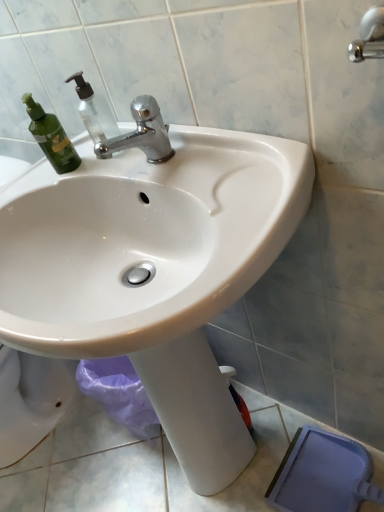
Question: Can you confirm if white glossy sink at center is shorter than polished chrome faucet at upper center?

Choices:
 (A) no
 (B) yes

Answer: (A)

Question: From the image's perspective, is white glossy sink at center located beneath polished chrome faucet at upper center?

Choices:
 (A) yes
 (B) no

Answer: (A)

Question: From the image's perspective, does white glossy sink at center appear higher than polished chrome faucet at upper center?

Choices:
 (A) no
 (B) yes

Answer: (A)

Question: From a real-world perspective, is white glossy sink at center over polished chrome faucet at upper center?

Choices:
 (A) yes
 (B) no

Answer: (B)

Question: Can you confirm if white glossy sink at center is positioned to the right of polished chrome faucet at upper center?

Choices:
 (A) no
 (B) yes

Answer: (B)

Question: From the image's perspective, is white glossy sink at center located above or below polished chrome faucet at upper center?

Choices:
 (A) below
 (B) above

Answer: (A)

Question: Is white glossy sink at center to the left or to the right of polished chrome faucet at upper center in the image?

Choices:
 (A) right
 (B) left

Answer: (A)

Question: Is white glossy sink at center bigger or smaller than polished chrome faucet at upper center?

Choices:
 (A) big
 (B) small

Answer: (A)

Question: From a real-world perspective, is white glossy sink at center above or below polished chrome faucet at upper center?

Choices:
 (A) above
 (B) below

Answer: (B)

Question: In terms of height, does polished chrome faucet at upper center look taller or shorter compared to transparent plastic soap dispenser at upper left?

Choices:
 (A) short
 (B) tall

Answer: (A)

Question: From the image's perspective, relative to transparent plastic soap dispenser at upper left, is polished chrome faucet at upper center above or below?

Choices:
 (A) below
 (B) above

Answer: (A)

Question: In the image, is polished chrome faucet at upper center on the left side or the right side of transparent plastic soap dispenser at upper left?

Choices:
 (A) left
 (B) right

Answer: (B)

Question: Is polished chrome faucet at upper center wider or thinner than transparent plastic soap dispenser at upper left?

Choices:
 (A) wide
 (B) thin

Answer: (A)

Question: Is transparent plastic soap dispenser at upper left bigger or smaller than white glossy sink at center?

Choices:
 (A) big
 (B) small

Answer: (B)

Question: Looking at their shapes, would you say transparent plastic soap dispenser at upper left is wider or thinner than white glossy sink at center?

Choices:
 (A) thin
 (B) wide

Answer: (A)